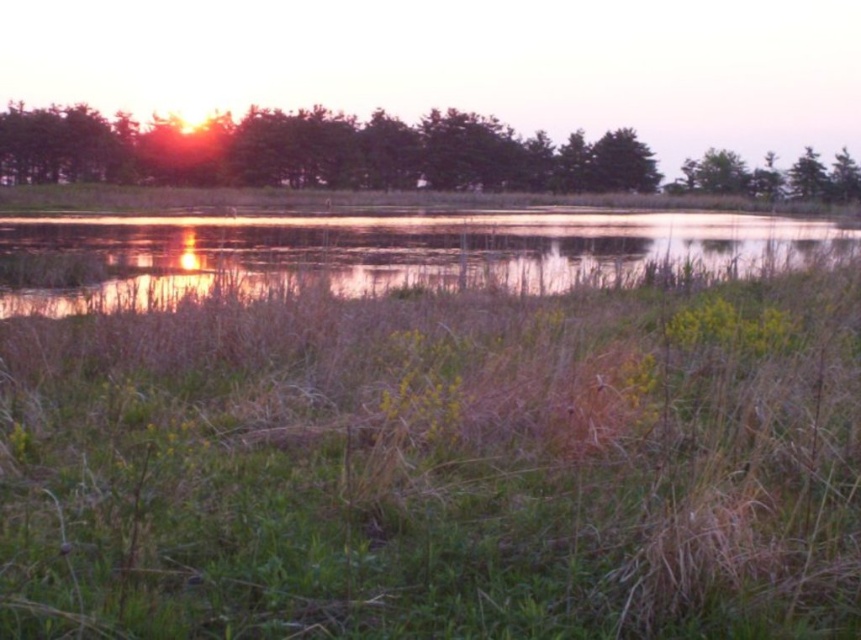
Question: Is the position of green grassy at center less distant than that of reflective water at center?

Choices:
 (A) yes
 (B) no

Answer: (A)

Question: Can you confirm if reflective water at center is thinner than green leafy trees at upper center?

Choices:
 (A) yes
 (B) no

Answer: (A)

Question: Among these points, which one is nearest to the camera?

Choices:
 (A) (733, 228)
 (B) (294, 490)
 (C) (197, 163)

Answer: (B)

Question: Does green grassy at center appear under green leafy trees at upper center?

Choices:
 (A) no
 (B) yes

Answer: (B)

Question: Which of the following is the farthest from the observer?

Choices:
 (A) (98, 390)
 (B) (655, 214)
 (C) (456, 173)

Answer: (C)

Question: Which point is farther from the camera taking this photo?

Choices:
 (A) (159, 164)
 (B) (779, 221)
 (C) (42, 410)

Answer: (A)